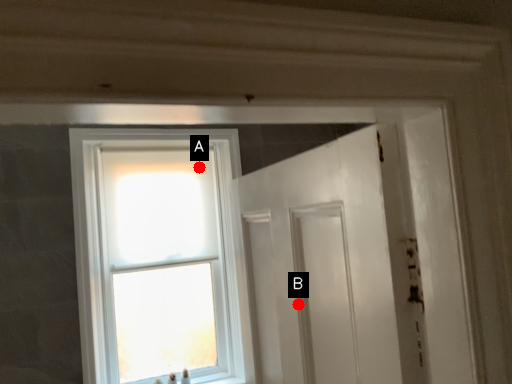
Question: Two points are circled on the image, labeled by A and B beside each circle. Which of the following is the closest to the observer?

Choices:
 (A) A is closer
 (B) B is closer

Answer: (B)